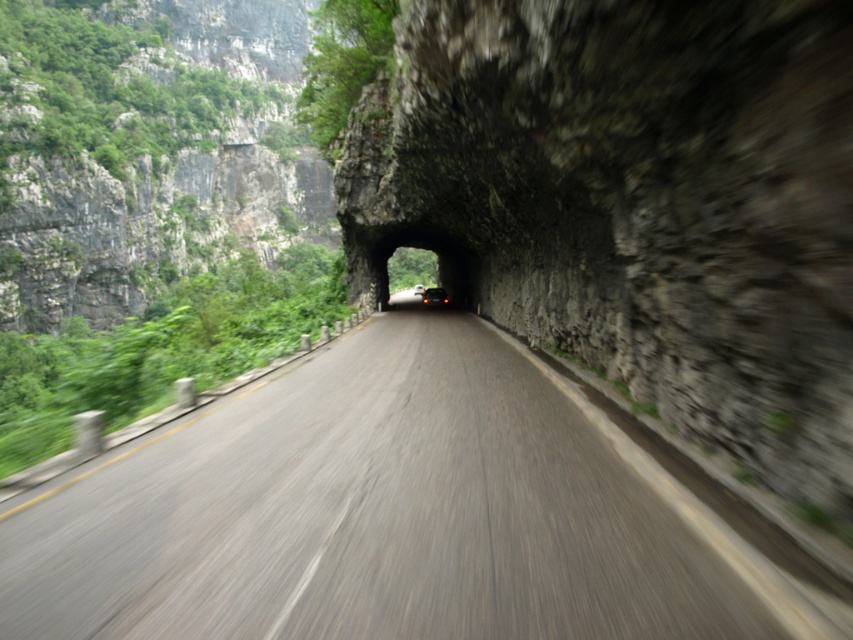
You are driving a matte black car at center and want to stay on the smooth asphalt road at center. Based on their positions, is there a risk of the car drifting off the road?

The smooth asphalt road at center is below the matte black car at center, so the car is positioned on the road. There is no immediate risk of drifting off as long as the driver maintains control.

You are driving a car that is 4.5 meters long. You see a point at point [815,627]. Can your car fit between your current position and that point without any part of the car exceeding the point?

The distance between your current position and the point at point [815,627] is 3.40 meters. Since your car is 4.5 meters long, it cannot fit within that space. You need to find a different route or adjust your path to ensure the entire vehicle stays within the available space.